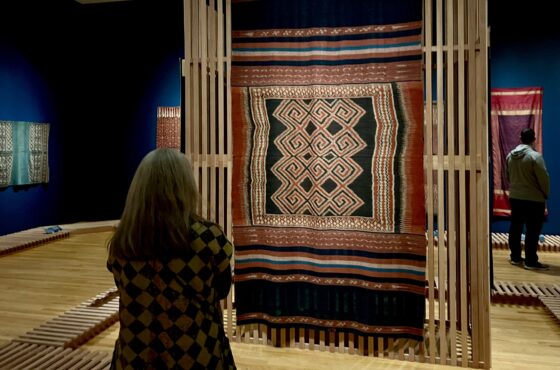
In order to click on hardwood flooring in this screenshot , I will do `click(274, 357)`.